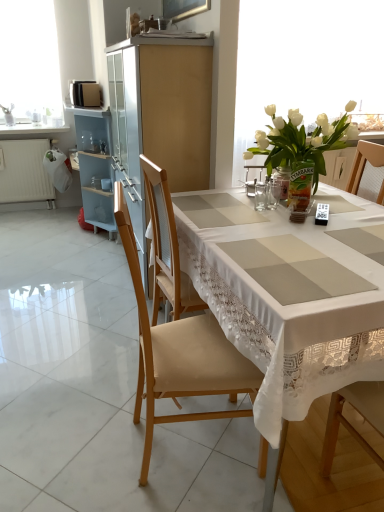
Question: Is wooden chair at center, marked as the first chair in a front-to-back arrangement, not close to white glossy countertop at upper left?

Choices:
 (A) yes
 (B) no

Answer: (A)

Question: Can you confirm if wooden chair at center, which ranks as the 2th chair in back-to-front order, is smaller than white glossy countertop at upper left?

Choices:
 (A) yes
 (B) no

Answer: (B)

Question: Is wooden chair at center, which ranks as the 2th chair in back-to-front order, wider than white glossy countertop at upper left?

Choices:
 (A) no
 (B) yes

Answer: (A)

Question: Considering the relative positions of wooden chair at center, marked as the first chair in a front-to-back arrangement, and white glossy countertop at upper left in the image provided, is wooden chair at center, marked as the first chair in a front-to-back arrangement, in front of white glossy countertop at upper left?

Choices:
 (A) yes
 (B) no

Answer: (A)

Question: Does wooden chair at center, marked as the first chair in a front-to-back arrangement, come behind white glossy countertop at upper left?

Choices:
 (A) yes
 (B) no

Answer: (B)

Question: Is wooden chair at center, which ranks as the 2th chair in back-to-front order, shorter than white glossy countertop at upper left?

Choices:
 (A) yes
 (B) no

Answer: (B)

Question: From a real-world perspective, is translucent glass vase at upper right physically above white glass vase at upper right?

Choices:
 (A) no
 (B) yes

Answer: (A)

Question: Are translucent glass vase at upper right and white glass vase at upper right beside each other?

Choices:
 (A) no
 (B) yes

Answer: (A)

Question: Is translucent glass vase at upper right far from white glass vase at upper right?

Choices:
 (A) no
 (B) yes

Answer: (B)

Question: Is the depth of translucent glass vase at upper right greater than that of white glass vase at upper right?

Choices:
 (A) yes
 (B) no

Answer: (B)

Question: Is translucent glass vase at upper right bigger than white glass vase at upper right?

Choices:
 (A) no
 (B) yes

Answer: (A)

Question: Can you confirm if translucent glass vase at upper right is thinner than white glass vase at upper right?

Choices:
 (A) no
 (B) yes

Answer: (B)

Question: From the image's perspective, would you say white glass vase at upper right is positioned over clear glass jar at center?

Choices:
 (A) no
 (B) yes

Answer: (B)